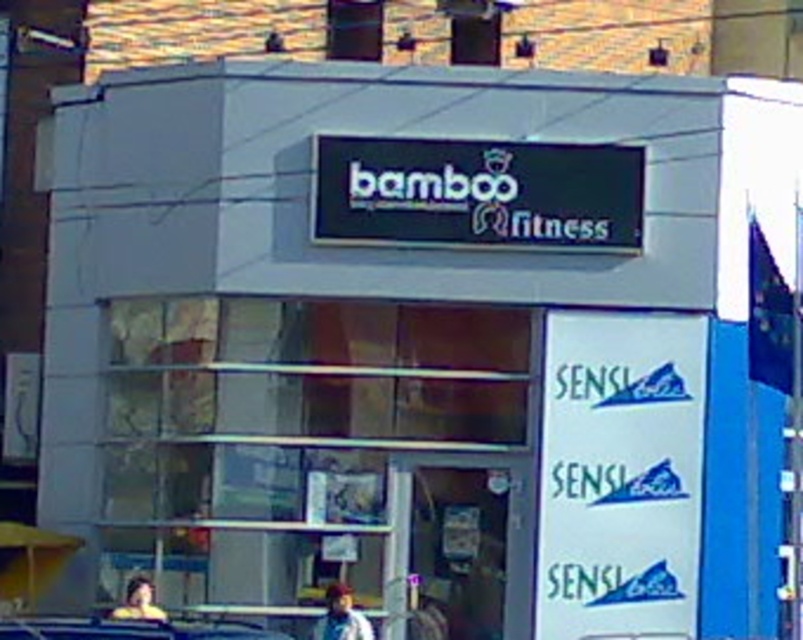
Which is below, metallic silver car at lower center or light brown hair at lower left?

Positioned lower is light brown hair at lower left.

Does metallic silver car at lower center lie in front of light brown hair at lower left?

Yes.

Between point (157, 637) and point (145, 614), which one is positioned in front?

Point (157, 637) is more forward.

Identify the location of metallic silver car at lower center. The image size is (803, 640). (127, 628).

Consider the image. Is metallic silver car at lower center to the left of blue denim jacket at lower center from the viewer's perspective?

Indeed, metallic silver car at lower center is positioned on the left side of blue denim jacket at lower center.

Is metallic silver car at lower center below blue denim jacket at lower center?

No.

Image resolution: width=803 pixels, height=640 pixels. Describe the element at coordinates (127, 628) in the screenshot. I see `metallic silver car at lower center` at that location.

Locate an element on the screen. This screenshot has height=640, width=803. metallic silver car at lower center is located at coordinates (127, 628).

Does blue denim jacket at lower center appear over light brown hair at lower left?

Incorrect, blue denim jacket at lower center is not positioned above light brown hair at lower left.

Does blue denim jacket at lower center have a greater height compared to light brown hair at lower left?

Correct, blue denim jacket at lower center is much taller as light brown hair at lower left.

The image size is (803, 640). What are the coordinates of `blue denim jacket at lower center` in the screenshot? It's located at (341, 616).

Locate an element on the screen. The image size is (803, 640). blue denim jacket at lower center is located at coordinates pos(341,616).